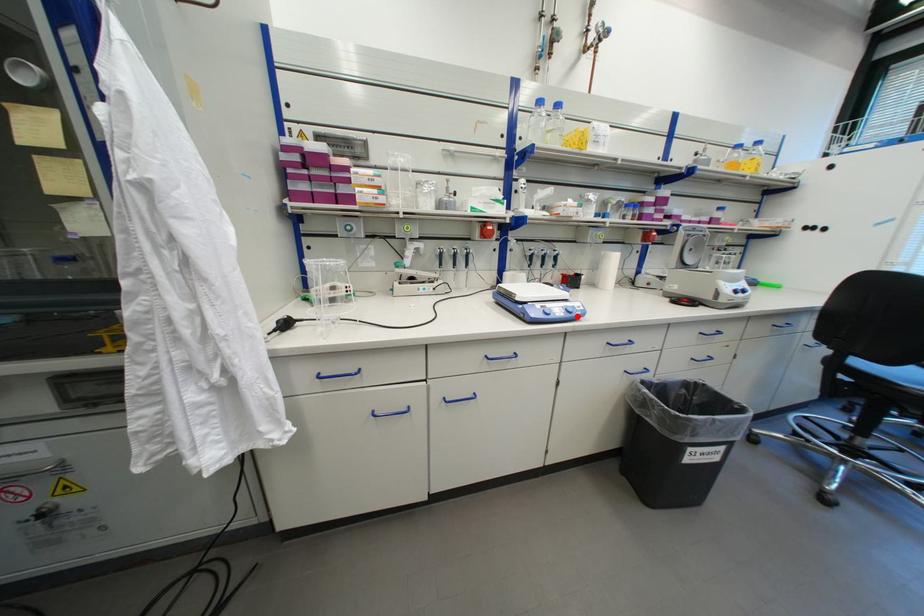
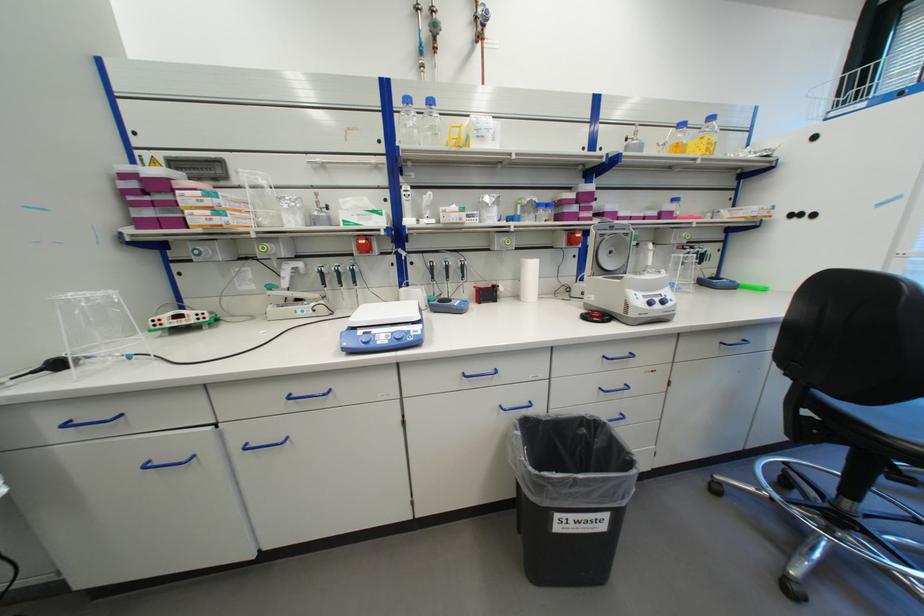
Find the pixel in the second image that matches the highlighted location in the first image.

(405, 344)